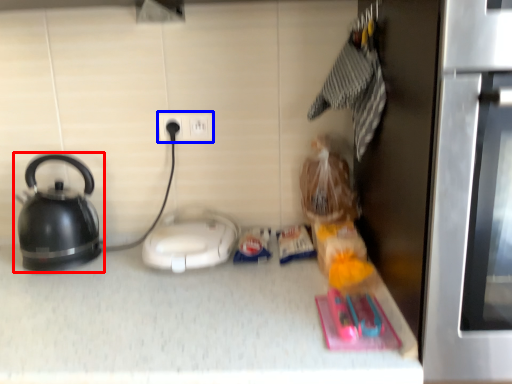
Question: Which object appears closest to the camera in this image, kettle (highlighted by a red box) or electric outlet (highlighted by a blue box)?

Choices:
 (A) kettle
 (B) electric outlet

Answer: (A)